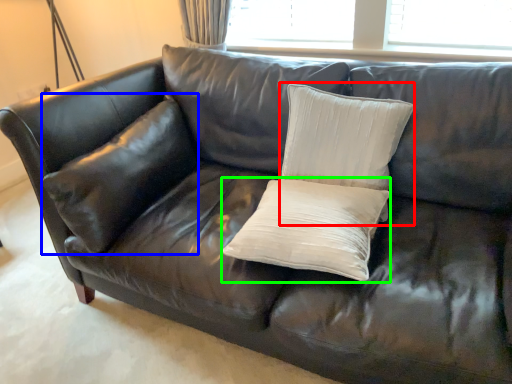
Question: Which object is the farthest from pillow (highlighted by a red box)? Choose among these: pillow (highlighted by a blue box) or pillow (highlighted by a green box).

Choices:
 (A) pillow
 (B) pillow

Answer: (A)